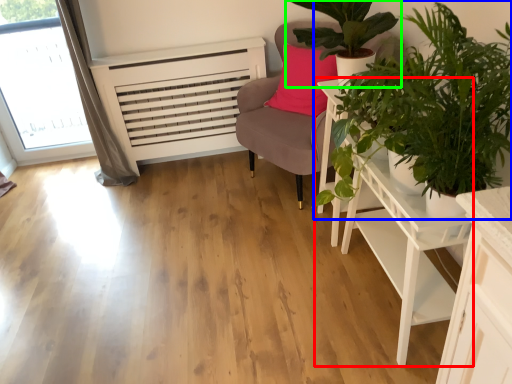
Question: Which object is positioned closest to table (highlighted by a red box)? Select from houseplant (highlighted by a blue box) and houseplant (highlighted by a green box).

Choices:
 (A) houseplant
 (B) houseplant

Answer: (A)